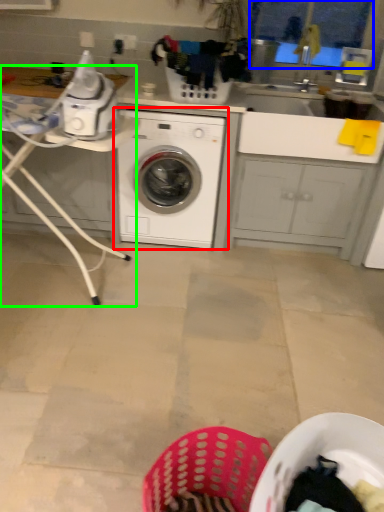
Question: Estimate the real-world distances between objects in this image. Which object is farther from washing machine (highlighted by a red box), window screen (highlighted by a blue box) or table (highlighted by a green box)?

Choices:
 (A) window screen
 (B) table

Answer: (A)